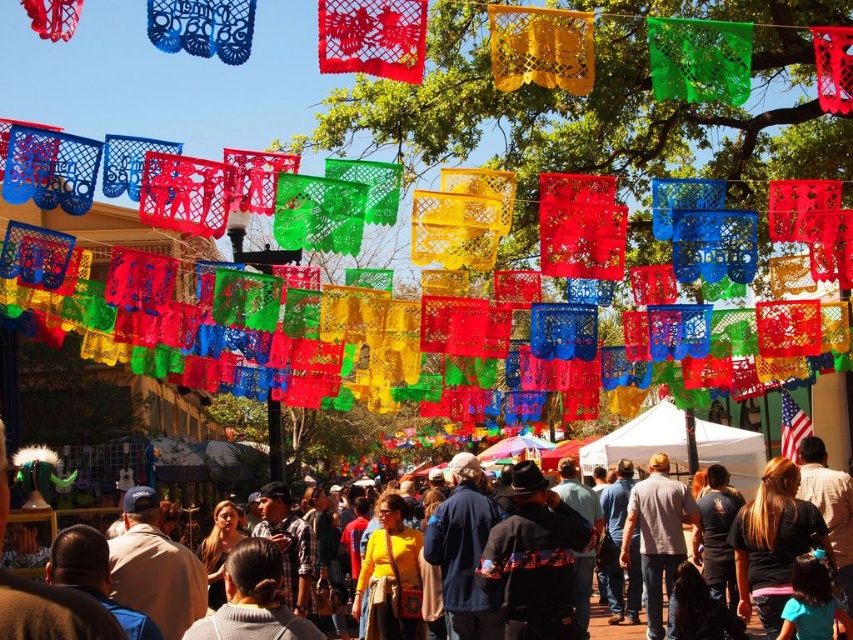
You are at the festival and want to place your yellow fabric purse at center into your light gray cotton shirt at center. Is this possible based on their sizes?

The yellow fabric purse at center is much taller than the light gray cotton shirt at center, so it won there is not enough space inside the light gray cotton shirt at center to fit the purse.